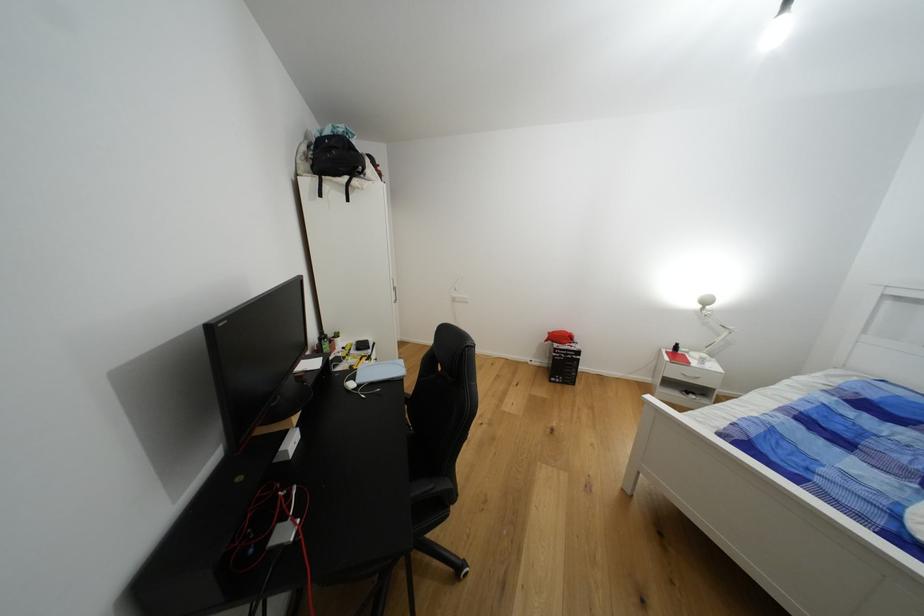
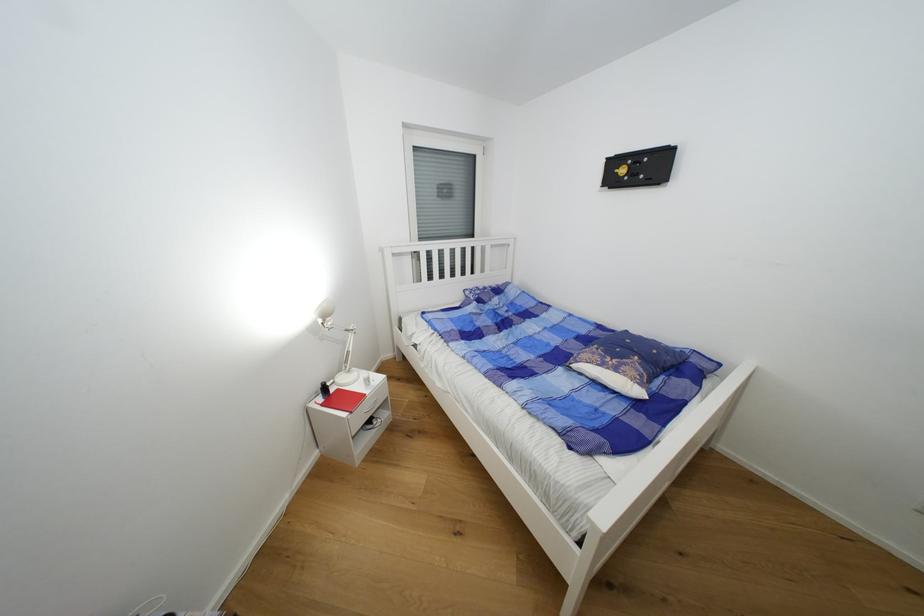
The point at (706,309) is marked in the first image. Where is the corresponding point in the second image?

(325, 323)